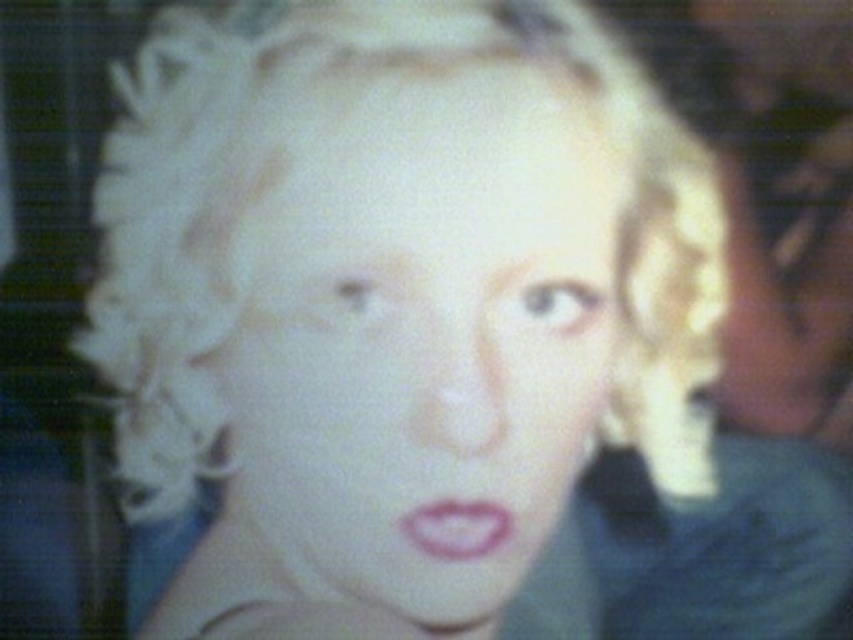
You are a photographer trying to adjust the focus of your camera. You have two points in the image, point (508, 250) and point (498, 504). Which point should you focus on to ensure the subject is sharp?

You should focus on point (508, 250) because it is closer to the viewer than point (498, 504), so focusing there will ensure the subject is sharp.

Based on the scene description, can you determine which object is closer to the viewer between the smooth skin face at center and the pink matte lips at center?

The smooth skin face at center is in front of the pink matte lips at center, so the smooth skin face at center is closer to the viewer.

Based on the description, can you determine the exact coordinates of the smooth skin face at center in the image?

The smooth skin face at center is located at the 2D coordinates of point (x=422, y=333).